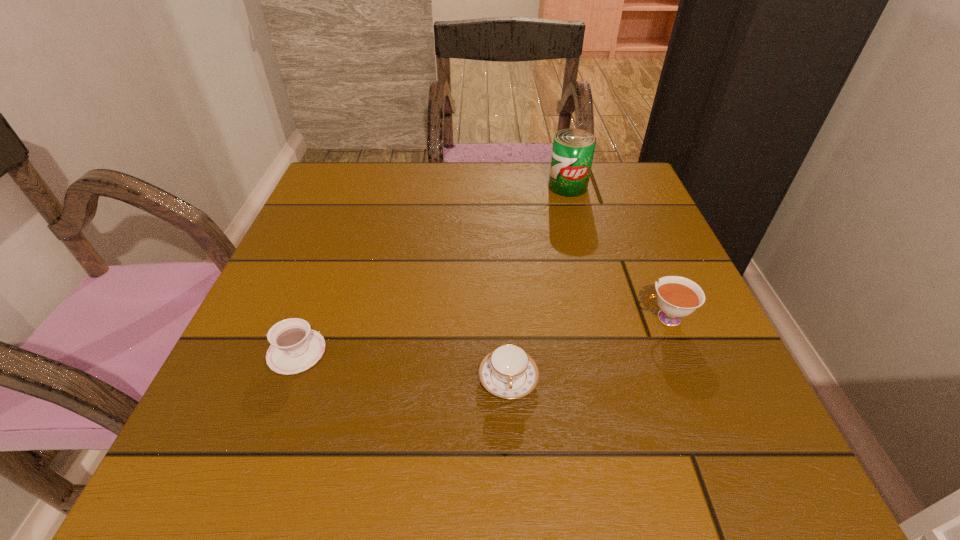
The width and height of the screenshot is (960, 540). Identify the location of free location that satisfies the following two spatial constraints: 1. on the side of the second tallest object with the handle; 2. on the side with the handle of the second teacup from left to right. (690, 379).

The height and width of the screenshot is (540, 960). In order to click on vacant point that satisfies the following two spatial constraints: 1. on the side of the rightmost object with the handle; 2. on the side with the handle of the second teacup from right to left in this screenshot , I will do point(690,379).

Where is `free location that satisfies the following two spatial constraints: 1. on the front side of the can; 2. on the handle side of the leftmost object`? free location that satisfies the following two spatial constraints: 1. on the front side of the can; 2. on the handle side of the leftmost object is located at coordinates pos(612,352).

At what (x,y) coordinates should I click in order to perform the action: click on vacant space that satisfies the following two spatial constraints: 1. on the side of the rightmost object with the handle; 2. on the side with the handle of the second object from left to right. Please return your answer as a coordinate pair (x, y). The width and height of the screenshot is (960, 540). Looking at the image, I should click on (690, 379).